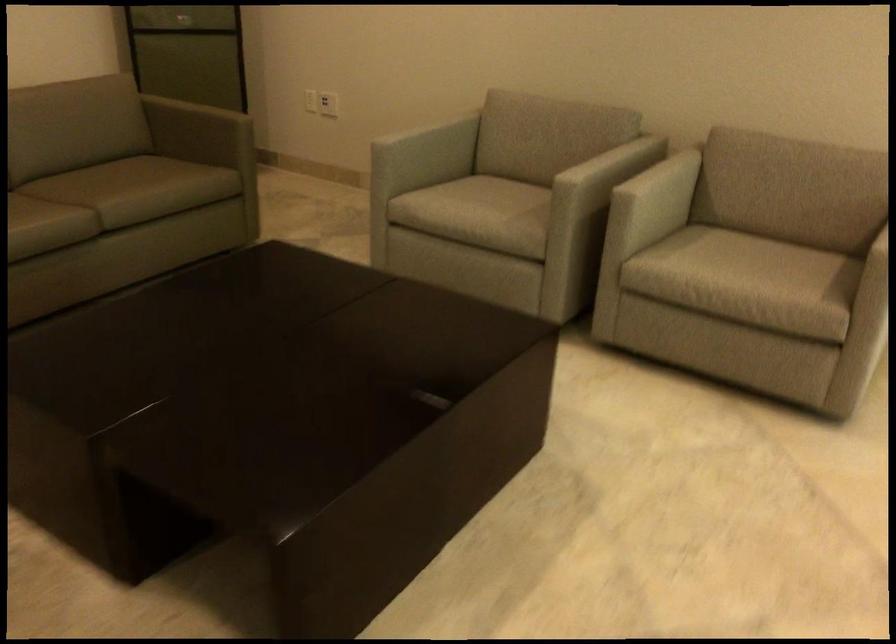
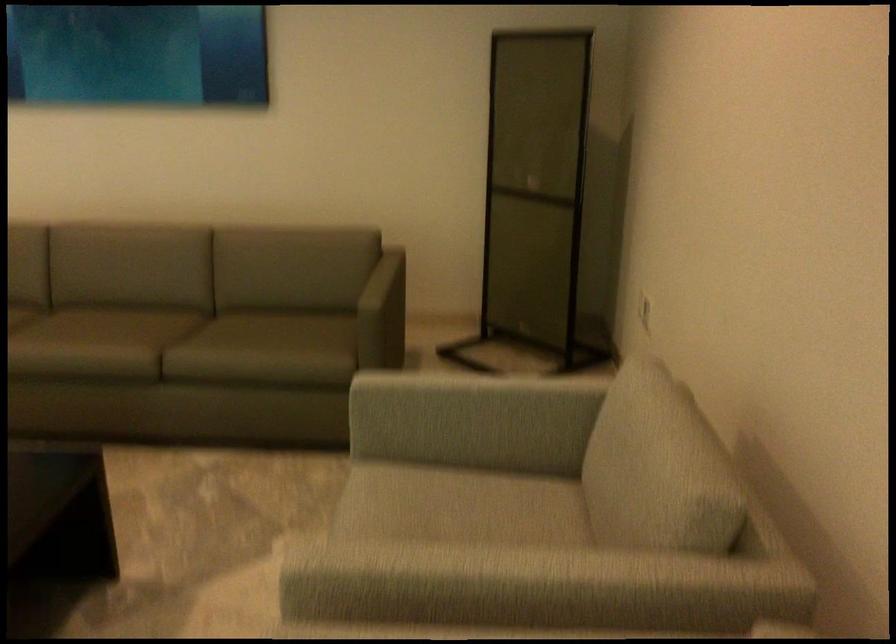
Where in the second image is the point corresponding to [592,160] from the first image?

(479, 573)